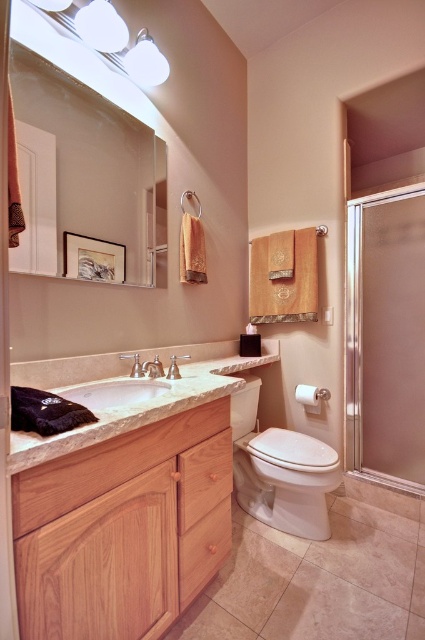
Question: Which point is farther to the camera?

Choices:
 (A) (161, 372)
 (B) (312, 401)
 (C) (408, 388)
 (D) (323, 504)

Answer: (C)

Question: From the image, what is the correct spatial relationship of frosted glass shower door at right in relation to wooden towel bar at center?

Choices:
 (A) right
 (B) left

Answer: (A)

Question: Can you confirm if white glossy toilet at center is thinner than wooden towel bar at center?

Choices:
 (A) yes
 (B) no

Answer: (B)

Question: Which point is closer to the camera?

Choices:
 (A) brushed metal faucet at sink left
 (B) white marble sink at center
 (C) clear glass screen door at left
 (D) white glossy toilet at center

Answer: (C)

Question: Which point is closer to the camera taking this photo?

Choices:
 (A) (142, 362)
 (B) (166, 385)
 (C) (138, 170)

Answer: (B)

Question: Is clear glass screen door at left in front of wooden towel bar at center?

Choices:
 (A) no
 (B) yes

Answer: (B)